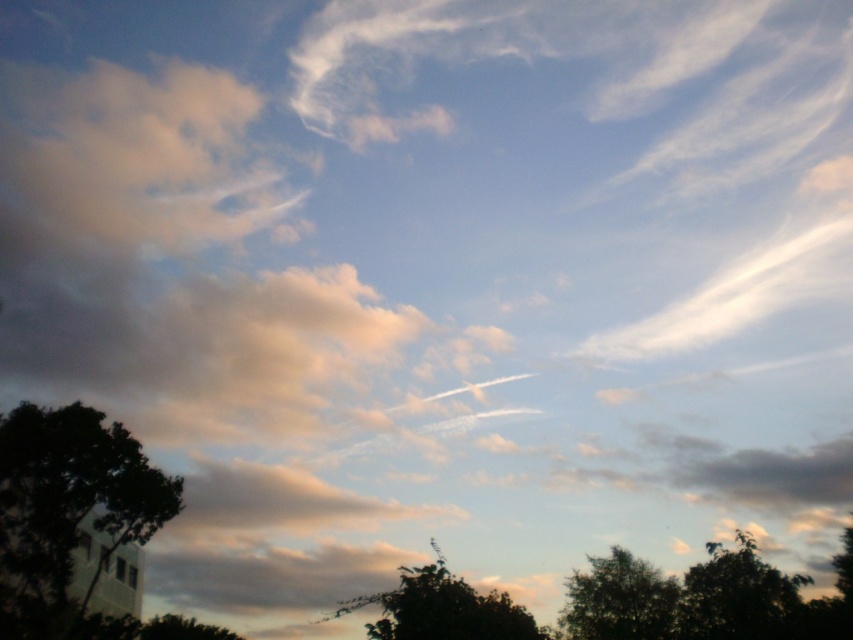
Question: Can you confirm if dark green leafy tree at lower right is positioned above green leafy tree at lower right?

Choices:
 (A) yes
 (B) no

Answer: (A)

Question: Which point appears closest to the camera in this image?

Choices:
 (A) (436, 579)
 (B) (744, 557)

Answer: (A)

Question: Where is dark green leafy tree at lower right located in relation to green leafy tree at lower center in the image?

Choices:
 (A) above
 (B) below

Answer: (B)

Question: Estimate the real-world distances between objects in this image. Which object is closer to the dark green leafy tree at lower right?

Choices:
 (A) green leafy tree at lower center
 (B) dark green leafy tree at lower left
 (C) green leafy tree at lower right

Answer: (C)

Question: Which object is farther from the camera taking this photo?

Choices:
 (A) green leafy tree at lower center
 (B) dark green leafy tree at lower right
 (C) green leafy tree at lower right
 (D) dark green leafy tree at lower left

Answer: (C)

Question: In this image, where is dark green leafy tree at lower left located relative to green leafy tree at lower right?

Choices:
 (A) above
 (B) below

Answer: (B)